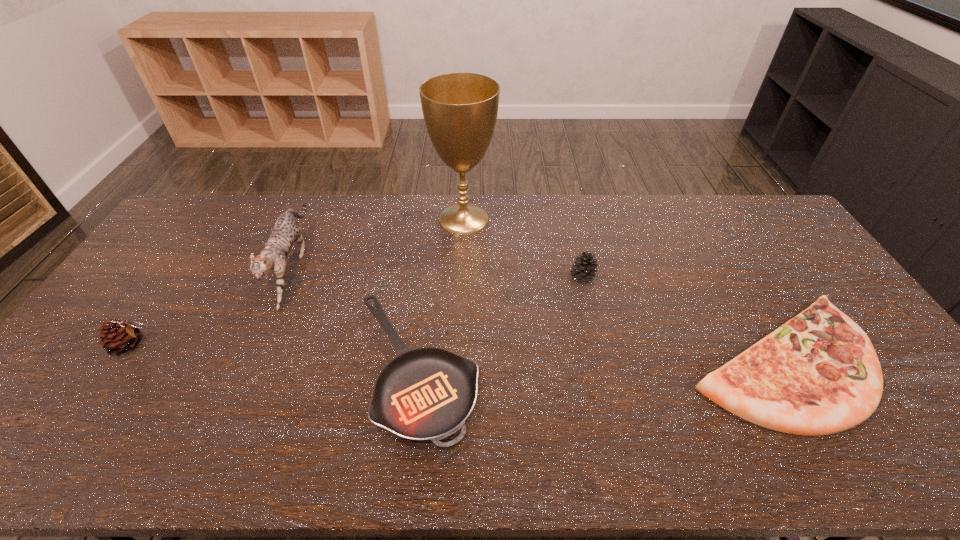
At what (x,y) coordinates should I click in order to perform the action: click on trophy cup. Please return your answer as a coordinate pair (x, y). Looking at the image, I should click on (460, 110).

You are a GUI agent. You are given a task and a screenshot of the screen. Output one action in this format:
    pyautogui.click(x=<x>, y=<y>)
    Task: Click on the cat
    The height and width of the screenshot is (540, 960).
    Given the screenshot: What is the action you would take?
    pyautogui.click(x=286, y=231)

Where is `the second tallest object`? The width and height of the screenshot is (960, 540). the second tallest object is located at coordinates (286, 231).

The height and width of the screenshot is (540, 960). In order to click on the farther pinecone in this screenshot , I will do (x=583, y=271).

In order to click on the right pinecone in this screenshot , I will do `click(583, 271)`.

Locate an element on the screen. Image resolution: width=960 pixels, height=540 pixels. the leftmost object is located at coordinates (119, 336).

The image size is (960, 540). Find the location of `the nearer pinecone`. the nearer pinecone is located at coordinates pos(119,336).

Locate an element on the screen. The image size is (960, 540). the rightmost object is located at coordinates (818, 374).

You are a GUI agent. You are given a task and a screenshot of the screen. Output one action in this format:
    pyautogui.click(x=<x>, y=<y>)
    Task: Click on the pizza
    This screenshot has height=540, width=960.
    Given the screenshot: What is the action you would take?
    pyautogui.click(x=818, y=374)

The image size is (960, 540). In order to click on frying pan in this screenshot , I will do `click(425, 394)`.